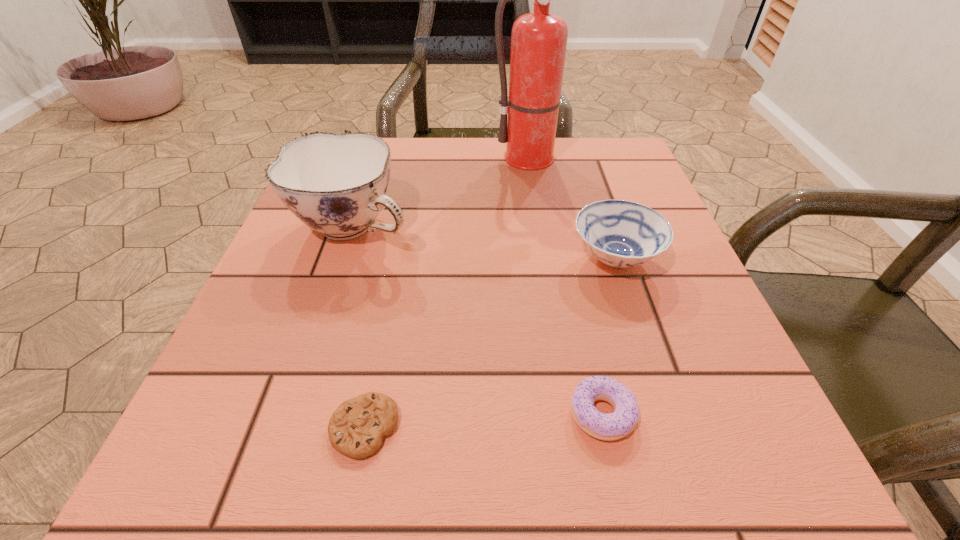
The width and height of the screenshot is (960, 540). In order to click on free region located on the right of the cookie in this screenshot , I will do `click(680, 427)`.

Image resolution: width=960 pixels, height=540 pixels. Find the location of `object located in the far edge section of the desktop`. object located in the far edge section of the desktop is located at coordinates (539, 39).

At what (x,y) coordinates should I click in order to perform the action: click on doughnut positioned at the near edge. Please return your answer as a coordinate pair (x, y). The image size is (960, 540). Looking at the image, I should click on (608, 427).

At what (x,y) coordinates should I click in order to perform the action: click on cookie at the near edge. Please return your answer as a coordinate pair (x, y). Looking at the image, I should click on (356, 429).

I want to click on object located at the left edge, so click(336, 184).

This screenshot has height=540, width=960. Identify the location of fire extinguisher positioned at the right edge. (539, 39).

This screenshot has width=960, height=540. Find the location of `soup bowl located in the right edge section of the desktop`. soup bowl located in the right edge section of the desktop is located at coordinates (620, 233).

Identify the location of object that is at the far right corner. (539, 39).

Locate an element on the screen. The height and width of the screenshot is (540, 960). free space at the far edge is located at coordinates (399, 151).

Where is `free space at the left edge`? The image size is (960, 540). free space at the left edge is located at coordinates (283, 269).